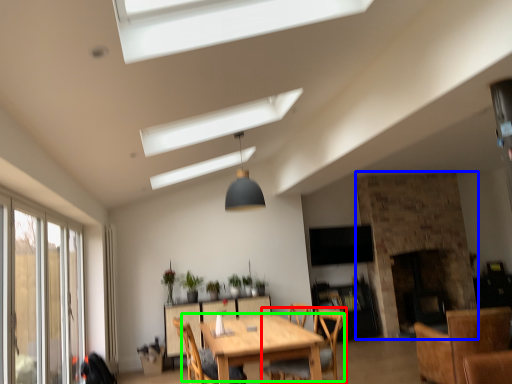
Question: Considering the real-world distances, which object is farthest from chair (highlighted by a red box)? fireplace (highlighted by a blue box) or kitchen & dining room table (highlighted by a green box)?

Choices:
 (A) fireplace
 (B) kitchen & dining room table

Answer: (A)